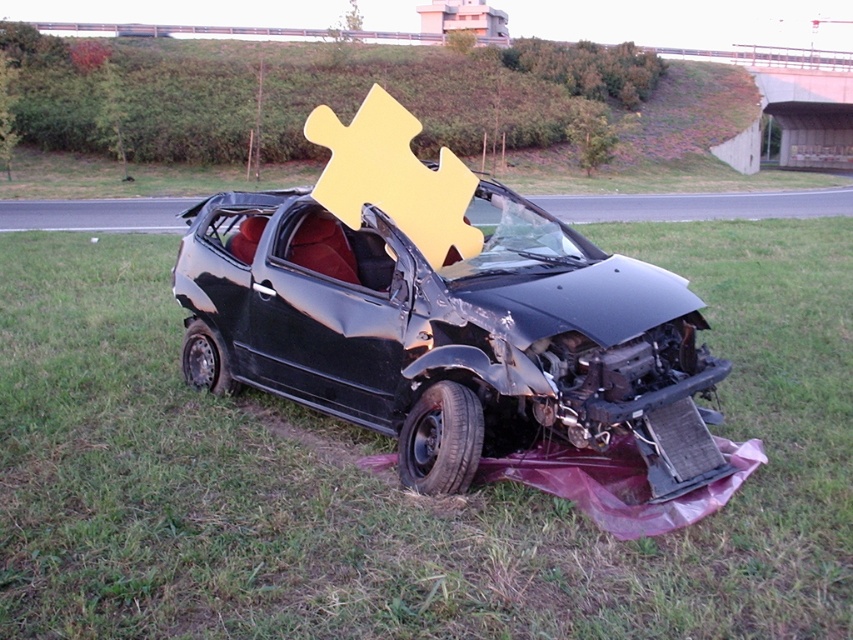
You are a pedestrian standing on the road and looking at the scene. Which object is located lower in the image, the green grass at center or the black matte car at center?

The green grass at center is located below the black matte car at center, so the green grass at center is lower in the image.

You are standing at the point marked by the large yellow puzzle piece graphic on the driver side window of the damaged black car. Looking towards the point at coordinate (393, 474), which is green grass at center, what direction should you move to reach the green grass at center?

The point at coordinate (393, 474) marks the green grass at center, so you should move towards that direction from the yellow puzzle piece graphic on the driver side window to reach it.